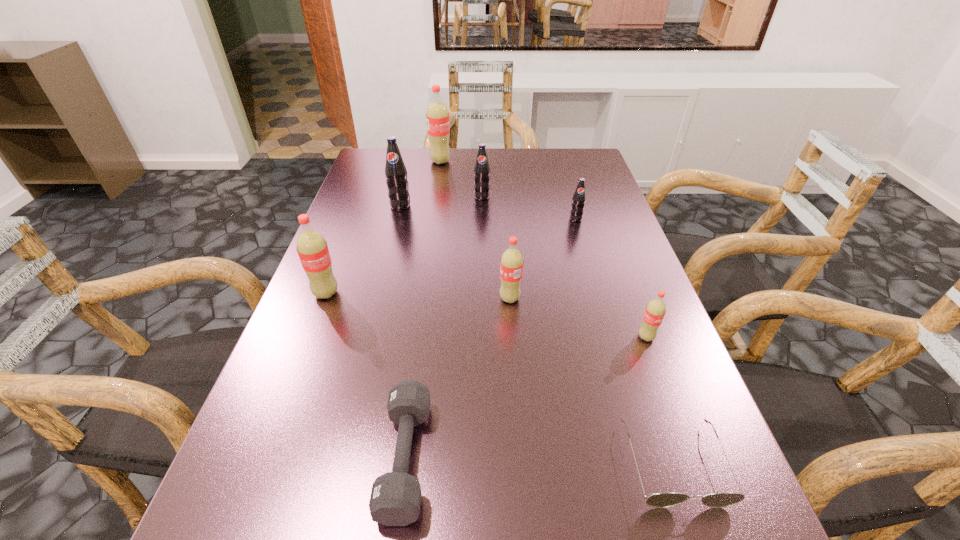
Find the location of a particular element. Image resolution: width=960 pixels, height=540 pixels. vacant area that lies between the third soda from left to right and the sixth soda from left to right is located at coordinates tap(508, 190).

Find the location of `free spot between the third nearest object and the third soda from right to left`. free spot between the third nearest object and the third soda from right to left is located at coordinates (578, 318).

The height and width of the screenshot is (540, 960). What are the coordinates of `blank region between the third red soda from left to right and the biggest red soda` in the screenshot? It's located at (475, 230).

Select which object appears as the sixth closest to the leftmost black pop. Please provide its 2D coordinates. Your answer should be formatted as a tuple, i.e. [(x, y)], where the tuple contains the x and y coordinates of a point satisfying the conditions above.

[(395, 499)]

Image resolution: width=960 pixels, height=540 pixels. Find the location of `object that is the third closest to the fifth soda from left to right`. object that is the third closest to the fifth soda from left to right is located at coordinates click(578, 200).

The width and height of the screenshot is (960, 540). In order to click on soda that stands as the third closest to the dumbbell in this screenshot , I will do `click(655, 310)`.

Choose which soda is the fifth nearest neighbor to the leftmost red soda. Please provide its 2D coordinates. Your answer should be formatted as a tuple, i.e. [(x, y)], where the tuple contains the x and y coordinates of a point satisfying the conditions above.

[(578, 200)]

Select which red soda is the third closest to the second biggest black pop. Please provide its 2D coordinates. Your answer should be formatted as a tuple, i.e. [(x, y)], where the tuple contains the x and y coordinates of a point satisfying the conditions above.

[(311, 246)]

Identify which red soda is the third nearest to the third biggest red soda. Please provide its 2D coordinates. Your answer should be formatted as a tuple, i.e. [(x, y)], where the tuple contains the x and y coordinates of a point satisfying the conditions above.

[(437, 116)]

Locate an element on the screen. Image resolution: width=960 pixels, height=540 pixels. the closest black pop to the third smallest red soda is located at coordinates (395, 171).